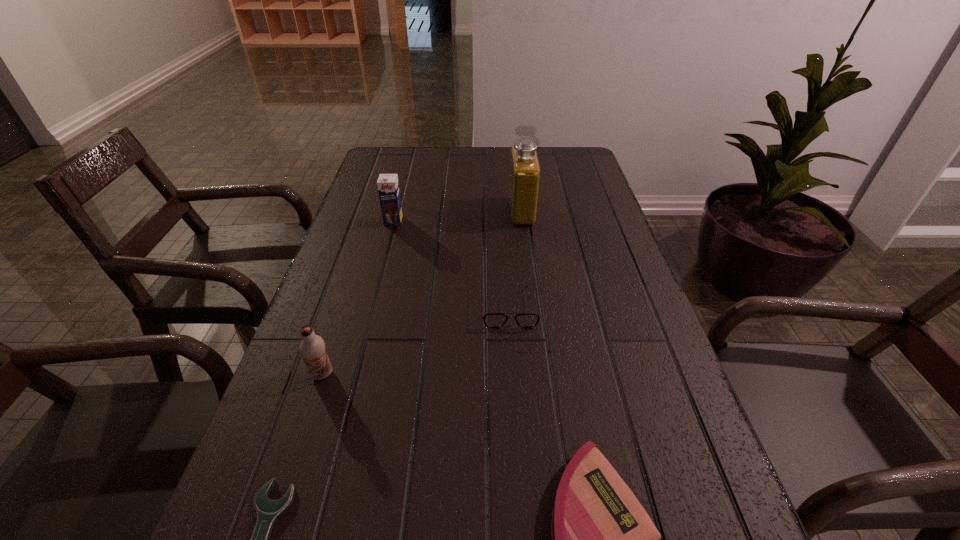
Image resolution: width=960 pixels, height=540 pixels. Identify the location of free space located 0.050m on the front label of the fourth object from right to left. (390, 236).

The image size is (960, 540). Identify the location of vacant space located 0.200m on the back of the left chocolate milk. [x=348, y=293].

This screenshot has width=960, height=540. What are the coordinates of `free space located 0.120m on the front-facing side of the third farthest object` in the screenshot? It's located at (514, 376).

Where is `blank area at the far edge`? This screenshot has height=540, width=960. blank area at the far edge is located at coordinates (466, 158).

Identify the location of blank area at the left edge. (316, 384).

Image resolution: width=960 pixels, height=540 pixels. In order to click on vacant space at the right edge of the desktop in this screenshot , I will do `click(601, 347)`.

The width and height of the screenshot is (960, 540). What are the coordinates of `vacant space at the far left corner of the desktop` in the screenshot? It's located at (409, 164).

The width and height of the screenshot is (960, 540). Find the location of `free spot at the far right corner of the desktop`. free spot at the far right corner of the desktop is located at coordinates (554, 151).

At what (x,y) coordinates should I click in order to perform the action: click on unoccupied area between the right chocolate milk and the left chocolate milk. Please return your answer as a coordinate pair (x, y). The height and width of the screenshot is (540, 960). Looking at the image, I should click on (358, 298).

Identify the location of unoccupied area between the tallest object and the nearer chocolate milk. (421, 293).